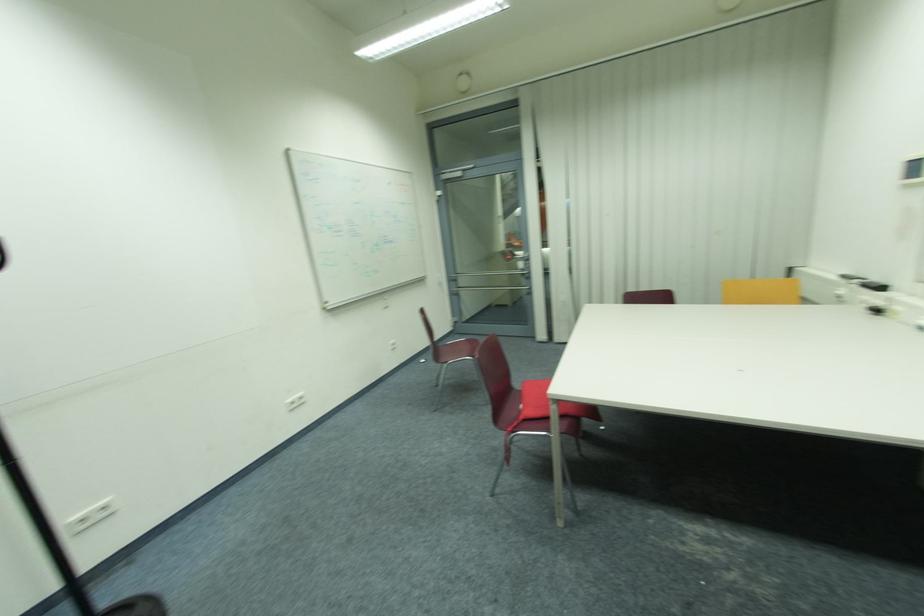
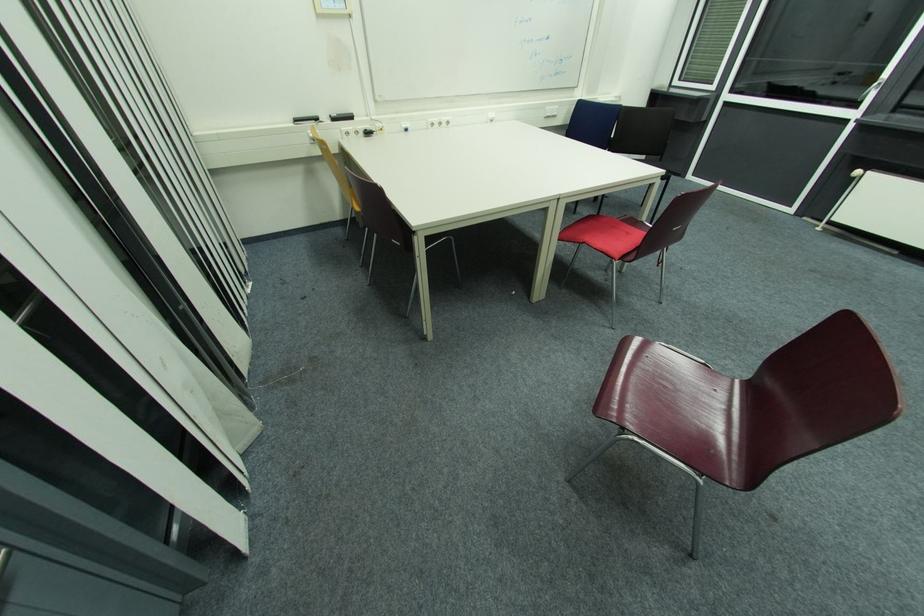
Where in the second image is the point corresponding to point (870, 286) from the first image?

(337, 121)